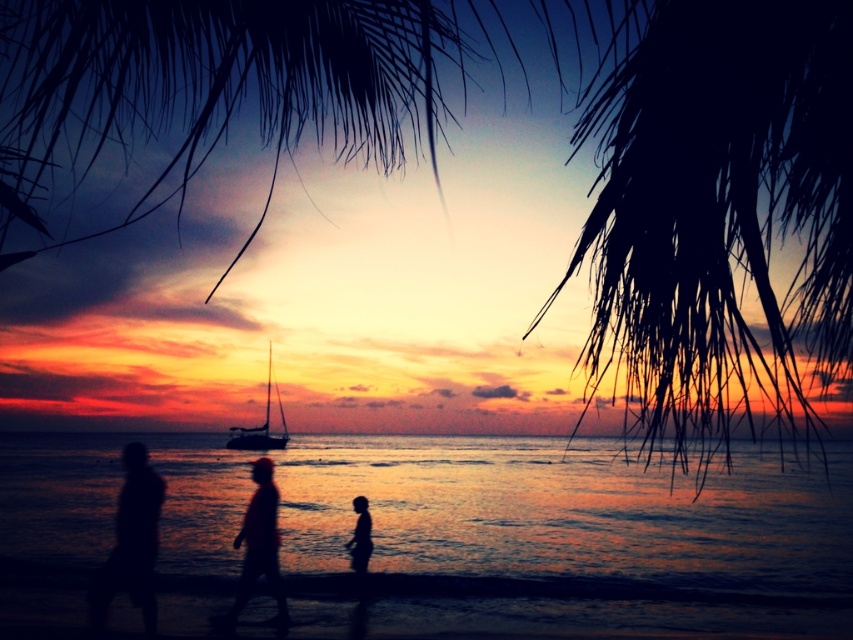
You are a photographer trying to capture the perfect sunset shot. You notice two silhouette figures in the frame. The silhouette figure at lower left and the silhouette figure at center. Which of these two figures appears taller in the photo?

The silhouette figure at center appears taller than the silhouette figure at lower left.

You are a photographer trying to capture the sunset at the beach. You notice the dark sand at lower center and the silhouette figure at lower left. Which object is closer to the camera based on their sizes?

The dark sand at lower center is much taller than the silhouette figure at lower left, indicating it is closer to the camera.

You are a photographer trying to capture the sunset scene. You notice two silhouette figures in the frame. Which of the two, the silhouette figure at lower left or the silhouette figure at center, appears narrower in the photo?

The silhouette figure at lower left appears narrower compared to the silhouette figure at center.